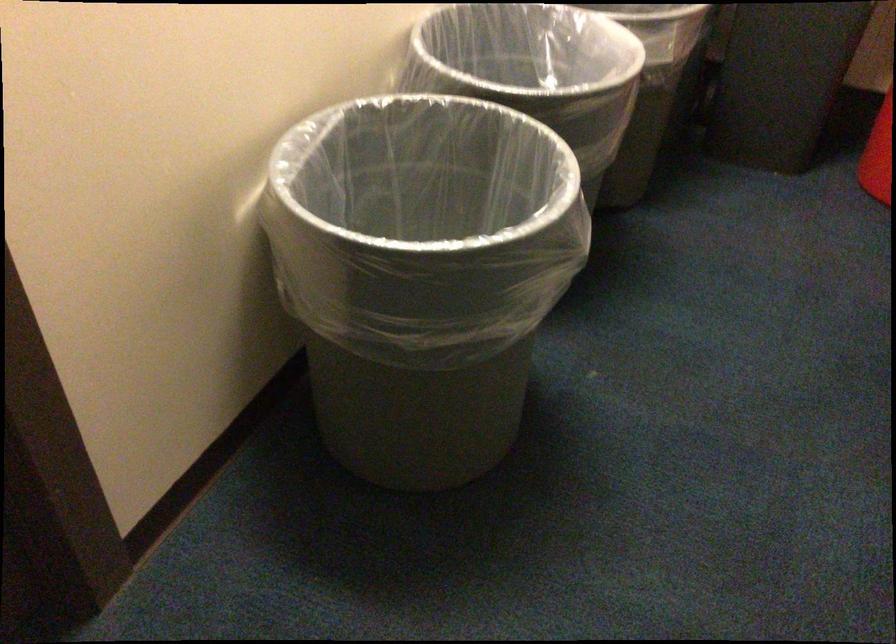
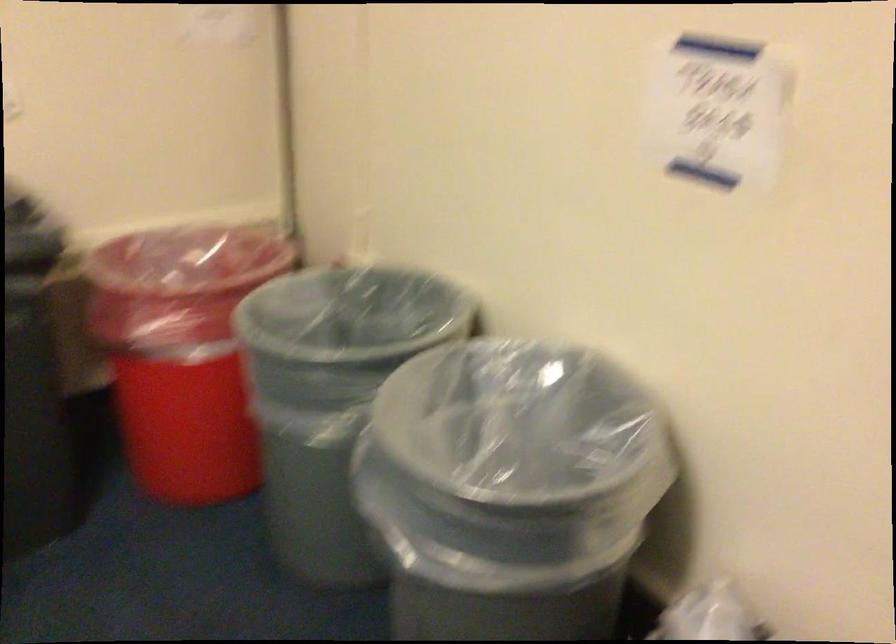
Question: The camera is either moving clockwise (left) or counter-clockwise (right) around the object. The first image is from the beginning of the video and the second image is from the end. Is the camera moving left or right when shooting the video?

Choices:
 (A) Left
 (B) Right

Answer: (A)